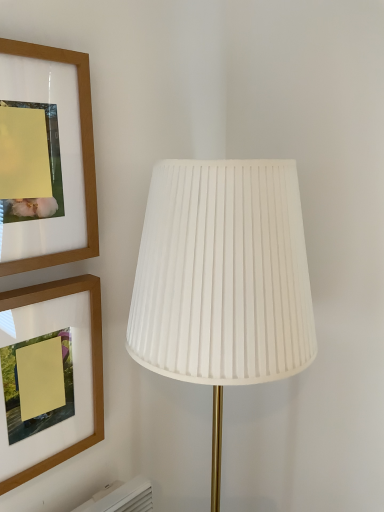
The image size is (384, 512). In order to click on wooden picture frame at upper left, which is the second picture frame from top to bottom in this screenshot , I will do `click(92, 362)`.

Find the location of a particular element. The height and width of the screenshot is (512, 384). wooden picture frame at upper left, the first picture frame in the bottom-to-top sequence is located at coordinates (92, 362).

Is wooden picture frame at upper left, marked as the 1th picture frame in a top-to-bottom arrangement, oriented away from white pleated fabric lamp at center?

wooden picture frame at upper left, marked as the 1th picture frame in a top-to-bottom arrangement, is not turned away from white pleated fabric lamp at center.

Is wooden picture frame at upper left, which is the second picture frame from bottom to top, surrounding white pleated fabric lamp at center?

No.

From a real-world perspective, which object rests below the other?

white pleated fabric lamp at center.

Is wooden picture frame at upper left, marked as the 1th picture frame in a top-to-bottom arrangement, smaller than white pleated fabric lamp at center?

Yes, wooden picture frame at upper left, marked as the 1th picture frame in a top-to-bottom arrangement, is smaller than white pleated fabric lamp at center.

Considering the sizes of objects wooden picture frame at upper left, which is the second picture frame from bottom to top, and wooden picture frame at upper left, the first picture frame in the bottom-to-top sequence, in the image provided, who is smaller, wooden picture frame at upper left, which is the second picture frame from bottom to top, or wooden picture frame at upper left, the first picture frame in the bottom-to-top sequence,?

wooden picture frame at upper left, which is the second picture frame from bottom to top.

The height and width of the screenshot is (512, 384). In order to click on picture frame on the right of wooden picture frame at upper left, which is the second picture frame from bottom to top in this screenshot , I will do `click(92, 362)`.

Would you say wooden picture frame at upper left, which is the second picture frame from bottom to top, contains wooden picture frame at upper left, the first picture frame in the bottom-to-top sequence?

No, wooden picture frame at upper left, the first picture frame in the bottom-to-top sequence, is not a part of wooden picture frame at upper left, which is the second picture frame from bottom to top.

From a real-world perspective, which object stands above the other?

In real-world perspective, wooden picture frame at upper left, which is the second picture frame from bottom to top, is above.

Consider the image. From the image's perspective, is white pleated fabric lamp at center above wooden picture frame at upper left, marked as the 1th picture frame in a top-to-bottom arrangement?

No, from the image's perspective, white pleated fabric lamp at center is not on top of wooden picture frame at upper left, marked as the 1th picture frame in a top-to-bottom arrangement.

Considering the relative positions of white pleated fabric lamp at center and wooden picture frame at upper left, which is the second picture frame from bottom to top, in the image provided, is white pleated fabric lamp at center to the right of wooden picture frame at upper left, which is the second picture frame from bottom to top, from the viewer's perspective?

Yes, white pleated fabric lamp at center is to the right of wooden picture frame at upper left, which is the second picture frame from bottom to top.

Which of these two, white pleated fabric lamp at center or wooden picture frame at upper left, the first picture frame in the bottom-to-top sequence, is bigger?

white pleated fabric lamp at center is bigger.

From the image's perspective, which is below, white pleated fabric lamp at center or wooden picture frame at upper left, the first picture frame in the bottom-to-top sequence?

white pleated fabric lamp at center is shown below in the image.

Considering the relative positions of white pleated fabric lamp at center and wooden picture frame at upper left, which is the second picture frame from top to bottom, in the image provided, is white pleated fabric lamp at center behind wooden picture frame at upper left, which is the second picture frame from top to bottom,?

That is False.

Is white pleated fabric lamp at center beside wooden picture frame at upper left, the first picture frame in the bottom-to-top sequence?

No, white pleated fabric lamp at center is not in contact with wooden picture frame at upper left, the first picture frame in the bottom-to-top sequence.

From the picture: Are wooden picture frame at upper left, which is the second picture frame from top to bottom, and white pleated fabric lamp at center far apart?

They are positioned close to each other.

Which object is further away from the camera, wooden picture frame at upper left, which is the second picture frame from top to bottom, or white pleated fabric lamp at center?

wooden picture frame at upper left, which is the second picture frame from top to bottom, is more distant.

From the image's perspective, between wooden picture frame at upper left, which is the second picture frame from top to bottom, and white pleated fabric lamp at center, who is located below?

A: From the image's view, white pleated fabric lamp at center is below.

This screenshot has width=384, height=512. I want to click on picture frame that is behind the wooden picture frame at upper left, marked as the 1th picture frame in a top-to-bottom arrangement, so click(92, 362).

Who is taller, wooden picture frame at upper left, the first picture frame in the bottom-to-top sequence, or wooden picture frame at upper left, which is the second picture frame from bottom to top?

wooden picture frame at upper left, the first picture frame in the bottom-to-top sequence, is taller.

Considering the relative sizes of wooden picture frame at upper left, the first picture frame in the bottom-to-top sequence, and wooden picture frame at upper left, marked as the 1th picture frame in a top-to-bottom arrangement, in the image provided, is wooden picture frame at upper left, the first picture frame in the bottom-to-top sequence, wider than wooden picture frame at upper left, marked as the 1th picture frame in a top-to-bottom arrangement,?

Yes.

Is wooden picture frame at upper left, the first picture frame in the bottom-to-top sequence, positioned with its back to wooden picture frame at upper left, marked as the 1th picture frame in a top-to-bottom arrangement?

wooden picture frame at upper left, the first picture frame in the bottom-to-top sequence, is not turned away from wooden picture frame at upper left, marked as the 1th picture frame in a top-to-bottom arrangement.

The height and width of the screenshot is (512, 384). Find the location of `picture frame that is the 2nd object above the white pleated fabric lamp at center (from a real-world perspective)`. picture frame that is the 2nd object above the white pleated fabric lamp at center (from a real-world perspective) is located at coordinates (82, 155).

Locate an element on the screen. picture frame behind the wooden picture frame at upper left, which is the second picture frame from bottom to top is located at coordinates (92, 362).

When comparing their distances from wooden picture frame at upper left, which is the second picture frame from top to bottom, does white pleated fabric lamp at center or wooden picture frame at upper left, which is the second picture frame from bottom to top, seem closer?

wooden picture frame at upper left, which is the second picture frame from bottom to top, is positioned closer to the anchor wooden picture frame at upper left, which is the second picture frame from top to bottom.

Considering their positions, is wooden picture frame at upper left, the first picture frame in the bottom-to-top sequence, positioned further to white pleated fabric lamp at center than wooden picture frame at upper left, which is the second picture frame from bottom to top?

Among the two, wooden picture frame at upper left, the first picture frame in the bottom-to-top sequence, is located further to white pleated fabric lamp at center.

Based on their spatial positions, is wooden picture frame at upper left, marked as the 1th picture frame in a top-to-bottom arrangement, or wooden picture frame at upper left, which is the second picture frame from top to bottom, further from white pleated fabric lamp at center?

wooden picture frame at upper left, which is the second picture frame from top to bottom.

Considering their positions, is white pleated fabric lamp at center positioned closer to wooden picture frame at upper left, marked as the 1th picture frame in a top-to-bottom arrangement, than wooden picture frame at upper left, the first picture frame in the bottom-to-top sequence?

Among the two, wooden picture frame at upper left, the first picture frame in the bottom-to-top sequence, is located nearer to wooden picture frame at upper left, marked as the 1th picture frame in a top-to-bottom arrangement.

Considering their positions, is wooden picture frame at upper left, which is the second picture frame from top to bottom, positioned further to wooden picture frame at upper left, marked as the 1th picture frame in a top-to-bottom arrangement, than white pleated fabric lamp at center?

The object further to wooden picture frame at upper left, marked as the 1th picture frame in a top-to-bottom arrangement, is white pleated fabric lamp at center.

In the scene shown: Estimate the real-world distances between objects in this image. Which object is closer to wooden picture frame at upper left, the first picture frame in the bottom-to-top sequence, wooden picture frame at upper left, marked as the 1th picture frame in a top-to-bottom arrangement, or white pleated fabric lamp at center?

Among the two, wooden picture frame at upper left, marked as the 1th picture frame in a top-to-bottom arrangement, is located nearer to wooden picture frame at upper left, the first picture frame in the bottom-to-top sequence.

This screenshot has height=512, width=384. In order to click on picture frame between wooden picture frame at upper left, marked as the 1th picture frame in a top-to-bottom arrangement, and white pleated fabric lamp at center in the up-down direction in this screenshot , I will do `click(92, 362)`.